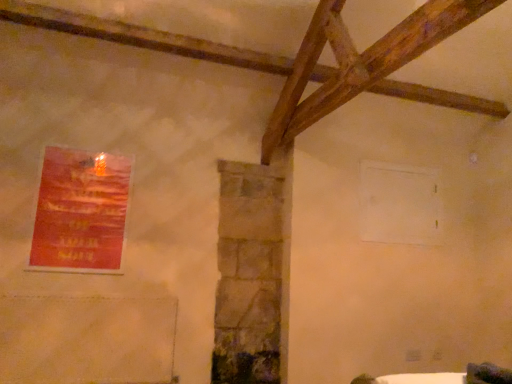
Identify the location of red paper poster at left. Image resolution: width=512 pixels, height=384 pixels. (80, 210).

What do you see at coordinates (80, 210) in the screenshot? The height and width of the screenshot is (384, 512). I see `red paper poster at left` at bounding box center [80, 210].

This screenshot has height=384, width=512. What are the coordinates of `red paper poster at left` in the screenshot? It's located at tap(80, 210).